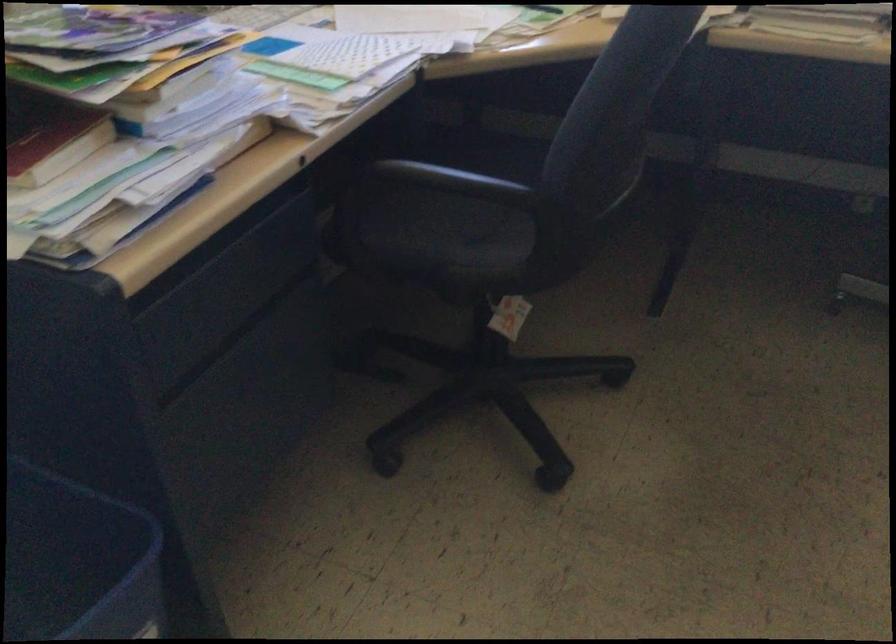
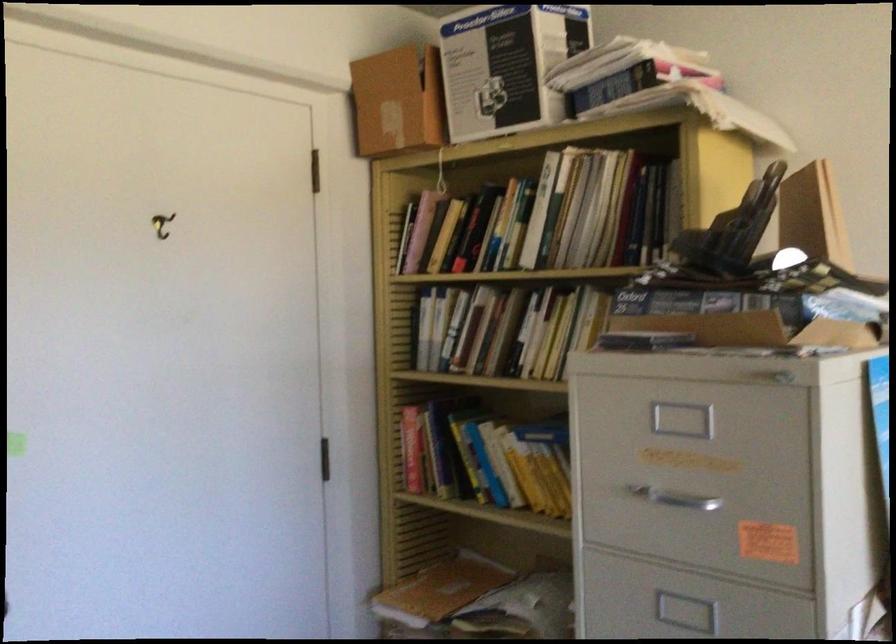
Question: The camera is either moving clockwise (left) or counter-clockwise (right) around the object. The first image is from the beginning of the video and the second image is from the end. Is the camera moving left or right when shooting the video?

Choices:
 (A) Left
 (B) Right

Answer: (B)